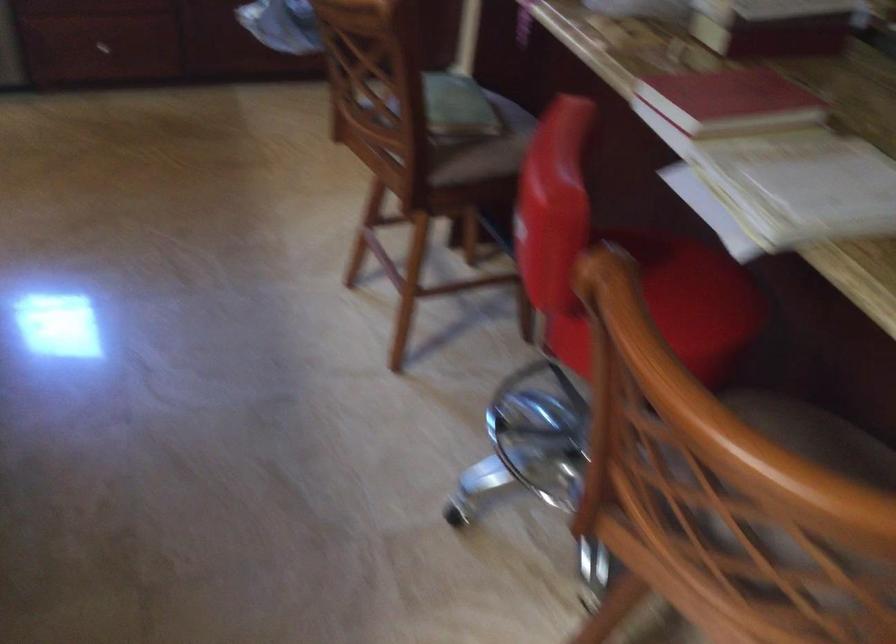
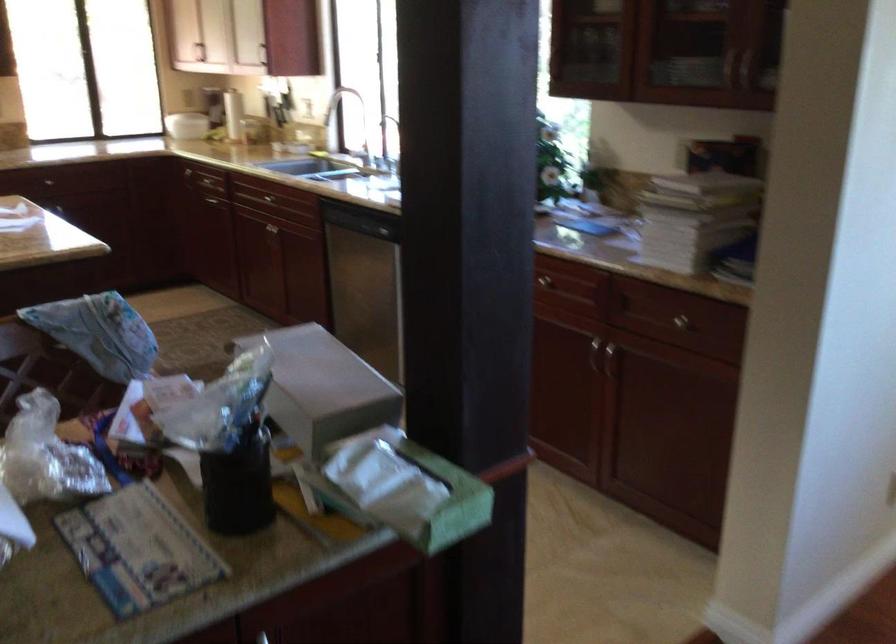
Question: I am providing you with two images of the same scene from different viewpoints. Which of the following objects are not visible in image2?

Choices:
 (A) dishwasher handle
 (B) silver drawer handle
 (C) green folded bag
 (D) green tissue box

Answer: (B)